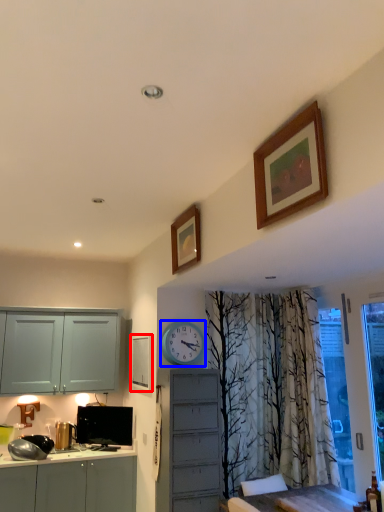
Question: Which of the following is the farthest to the observer, picture frame (highlighted by a red box) or clock (highlighted by a blue box)?

Choices:
 (A) picture frame
 (B) clock

Answer: (A)